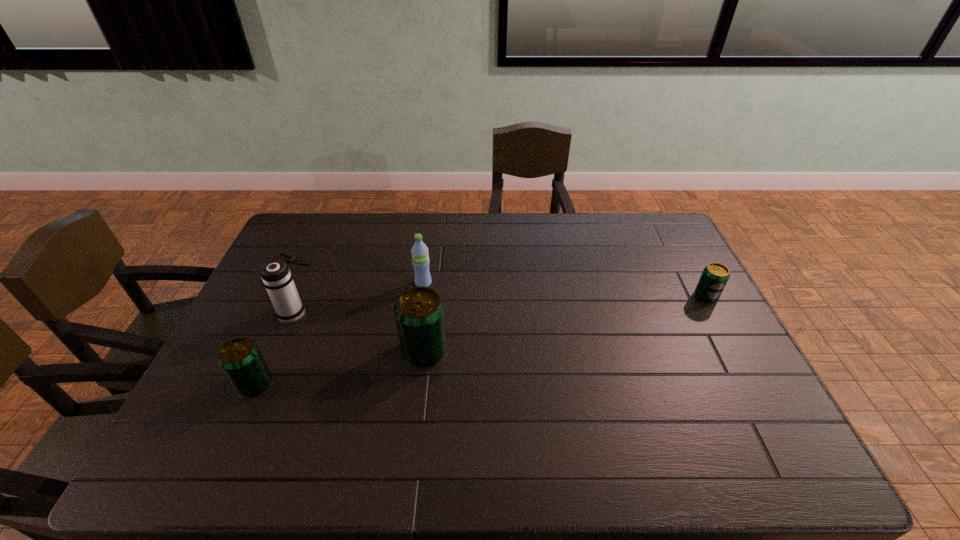
This screenshot has height=540, width=960. Find the location of `empty space that is in between the tallest beer can and the leftmost beer can`. empty space that is in between the tallest beer can and the leftmost beer can is located at coordinates (340, 367).

Identify the location of free space between the thermos bottle and the farthest beer can. (499, 305).

Locate an element on the screen. The image size is (960, 540). free space between the leftmost beer can and the farthest object is located at coordinates (275, 322).

I want to click on free point between the water bottle and the pliers, so click(x=359, y=272).

At what (x,y) coordinates should I click in order to perform the action: click on vacant space in between the shortest beer can and the second beer can from right to left. Please return your answer as a coordinate pair (x, y). Image resolution: width=960 pixels, height=540 pixels. Looking at the image, I should click on (565, 323).

Where is `vacant area that lies between the fifth tallest object and the thermos bottle`? The image size is (960, 540). vacant area that lies between the fifth tallest object and the thermos bottle is located at coordinates (499, 305).

Identify which object is located as the fifth nearest to the water bottle. Please provide its 2D coordinates. Your answer should be formatted as a tuple, i.e. [(x, y)], where the tuple contains the x and y coordinates of a point satisfying the conditions above.

[(715, 276)]

I want to click on object identified as the fifth closest to the thermos bottle, so click(715, 276).

Select which beer can appears as the closest to the pliers. Please provide its 2D coordinates. Your answer should be formatted as a tuple, i.e. [(x, y)], where the tuple contains the x and y coordinates of a point satisfying the conditions above.

[(241, 360)]

Find the location of a particular element. The width and height of the screenshot is (960, 540). beer can that stands as the third closest to the thermos bottle is located at coordinates (715, 276).